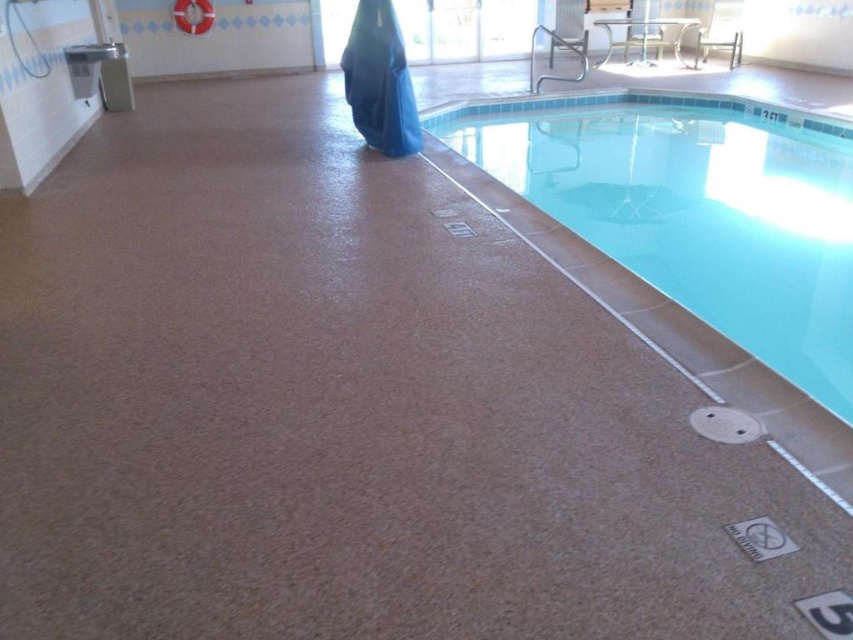
You are standing at the entrance of the indoor swimming pool area. You want to locate the smooth tile pool at center. According to the coordinates provided, where should you look?

The smooth tile pool at center is located at coordinates point (695,209).

You are a lifeguard standing at the edge of the smooth tile pool at center and looking upwards. Can you see the blue fabric robe at upper center from your current position?

Yes, because the smooth tile pool at center is below the blue fabric robe at upper center, so the lifeguard can see it when looking upwards.